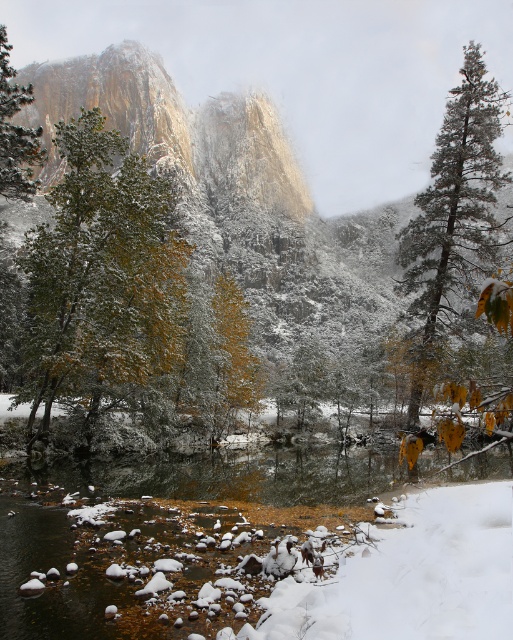
Question: Does green textured pine tree at right appear on the right side of green matte tree at left?

Choices:
 (A) yes
 (B) no

Answer: (A)

Question: Which object appears closest to the camera in this image?

Choices:
 (A) green matte tree at left
 (B) green textured pine tree at right
 (C) green matte tree at center

Answer: (A)

Question: Which object is farther from the camera taking this photo?

Choices:
 (A) green matte tree at center
 (B) green matte tree at left

Answer: (A)

Question: Which is nearer to the green matte tree at center?

Choices:
 (A) green matte tree at left
 (B) green textured pine tree at right

Answer: (A)

Question: Is green textured pine tree at right below green matte tree at left?

Choices:
 (A) yes
 (B) no

Answer: (B)

Question: Observing the image, what is the correct spatial positioning of green textured pine tree at right in reference to green matte tree at left?

Choices:
 (A) right
 (B) left

Answer: (A)